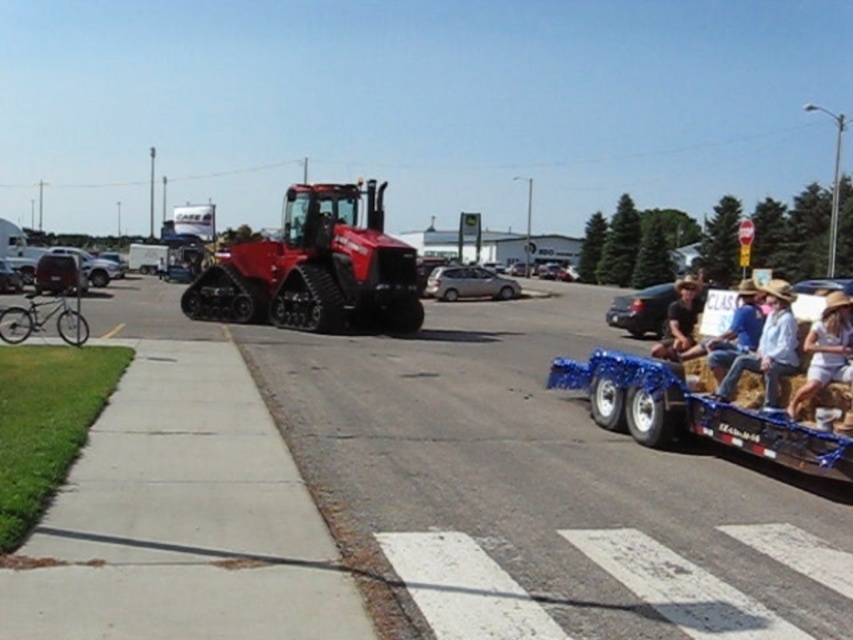
You are at the parade and want to take a photo of both the blue metallic wagon at lower right and the brushed metal bicycle at left. Which object should you position closer to the left side of your camera frame to include both in the photo?

You should position the brushed metal bicycle at left closer to the left side of your camera frame because the blue metallic wagon at lower right is already to the right of the brushed metal bicycle at left.

From the picture: You are standing at the center of the image. Which direction should you move to get closer to the white cotton dress at lower right represented by point (828,353)?

The white cotton dress at lower right is located at point (828,353). Since the point is in the lower right quadrant of the image, moving towards the lower right direction would bring you closer to it.